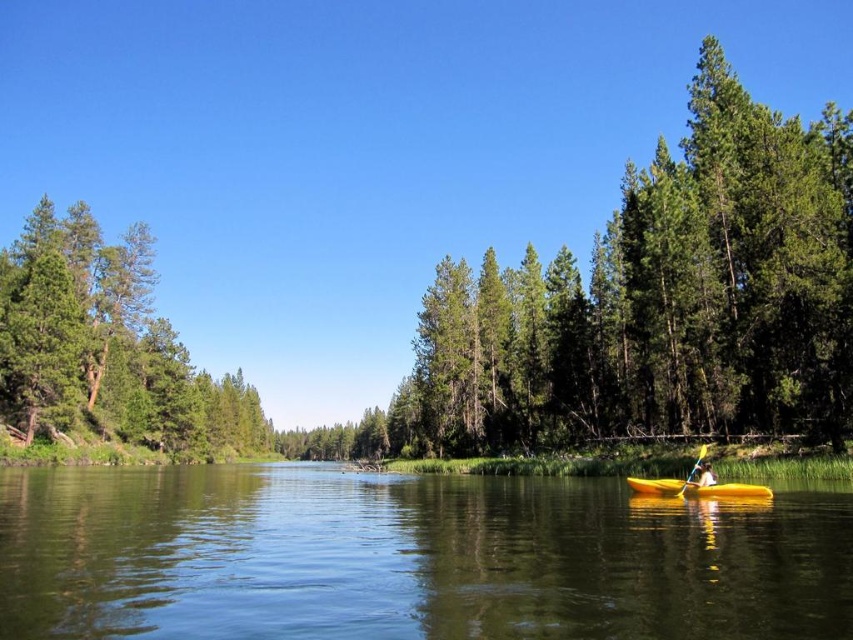
Question: Which object is the farthest from the smooth water at center?

Choices:
 (A) yellow matte kayak at lower center
 (B) yellow plastic kayak at center-right

Answer: (B)

Question: Estimate the real-world distances between objects in this image. Which object is farther from the yellow plastic kayak at center-right?

Choices:
 (A) green textured tree at center
 (B) smooth water at center
 (C) yellow plastic paddle at lower right
 (D) yellow matte kayak at lower center

Answer: (A)

Question: Is green textured tree at center to the right of yellow plastic kayak at center-right from the viewer's perspective?

Choices:
 (A) no
 (B) yes

Answer: (A)

Question: Is green matte tree at left wider than yellow matte kayak at lower center?

Choices:
 (A) no
 (B) yes

Answer: (B)

Question: Which of the following is the closest to the observer?

Choices:
 (A) (80, 515)
 (B) (55, 218)

Answer: (A)

Question: Considering the relative positions of smooth water at center and green textured tree at center in the image provided, where is smooth water at center located with respect to green textured tree at center?

Choices:
 (A) below
 (B) above

Answer: (B)